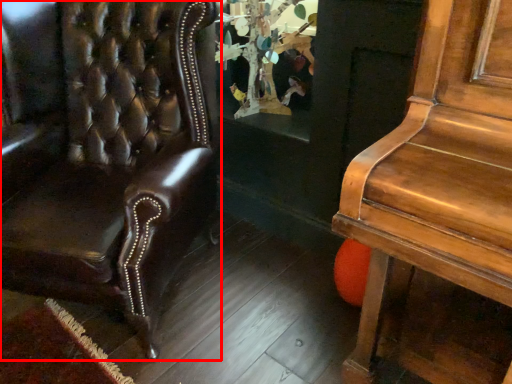
Question: Considering the relative positions of chair (annotated by the red box) and shop window in the image provided, where is chair (annotated by the red box) located with respect to the staircase?

Choices:
 (A) right
 (B) left

Answer: (B)